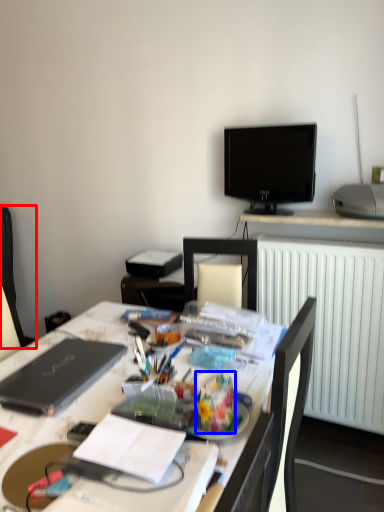
Question: Which object appears farthest to the camera in this image, computer chair (highlighted by a red box) or stationery (highlighted by a blue box)?

Choices:
 (A) computer chair
 (B) stationery

Answer: (A)